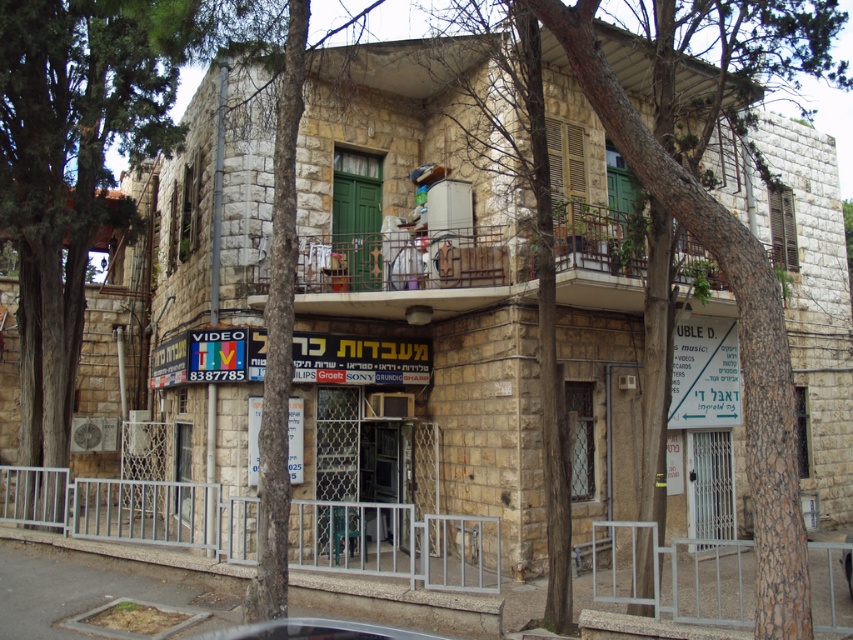
Question: Is green leafy tree at left bigger than metallic silver car at center?

Choices:
 (A) yes
 (B) no

Answer: (A)

Question: In this image, where is green leafy tree at left located relative to metallic silver car at center?

Choices:
 (A) below
 (B) above

Answer: (B)

Question: Is green leafy tree at left above metallic silver car at center?

Choices:
 (A) no
 (B) yes

Answer: (B)